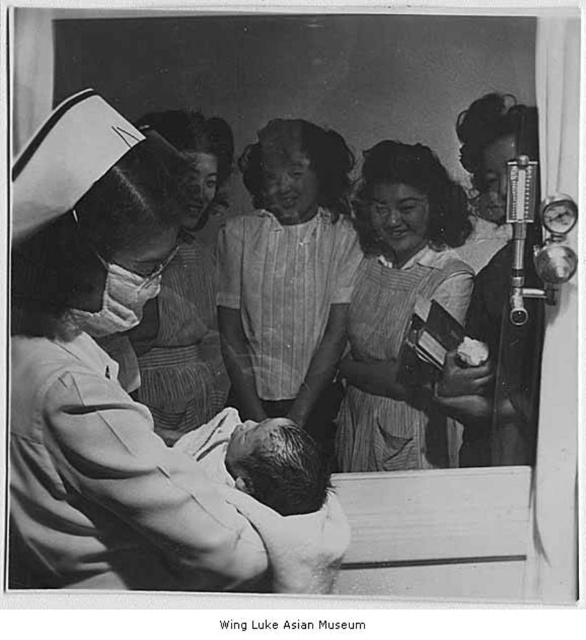
Question: Estimate the real-world distances between objects in this image. Which object is closer to the striped fabric blouse at center?

Choices:
 (A) white clothed nurse at left
 (B) smooth fabric dress at right
 (C) white matte mask at left
 (D) smooth skin baby at center

Answer: (D)

Question: Which of the following is the farthest from the observer?

Choices:
 (A) smooth fabric dress at right
 (B) matte white nurse cap at upper left

Answer: (A)

Question: Which object appears farthest from the camera in this image?

Choices:
 (A) striped cotton dress at center
 (B) smooth skin baby at center
 (C) white matte mask at left

Answer: (A)

Question: Is smooth fabric dress at right thinner than smooth skin baby at center?

Choices:
 (A) yes
 (B) no

Answer: (A)

Question: Is striped cotton dress at center further to camera compared to matte white nurse cap at upper left?

Choices:
 (A) yes
 (B) no

Answer: (A)

Question: Where is smooth fabric dress at right located in relation to smooth skin baby at center in the image?

Choices:
 (A) below
 (B) above

Answer: (B)